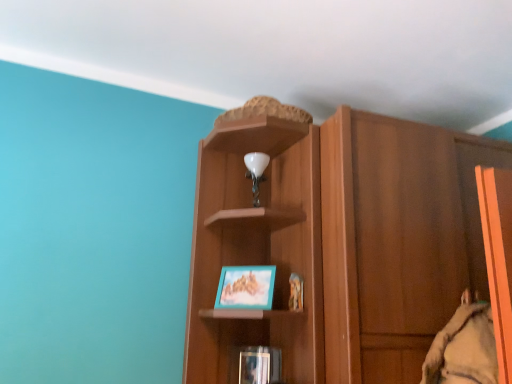
Question: From a real-world perspective, relative to wooden cupboard at center, is teal matte picture frame at center vertically above or below?

Choices:
 (A) below
 (B) above

Answer: (A)

Question: Considering the positions of teal matte picture frame at center and wooden cupboard at center in the image, is teal matte picture frame at center taller or shorter than wooden cupboard at center?

Choices:
 (A) tall
 (B) short

Answer: (B)

Question: Based on their relative distances, which object is farther from the teal matte picture frame at center?

Choices:
 (A) wooden cupboard at center
 (B) matte black book at lower center

Answer: (A)

Question: Which object is positioned closest to the wooden cupboard at center?

Choices:
 (A) matte black book at lower center
 (B) teal matte picture frame at center

Answer: (B)